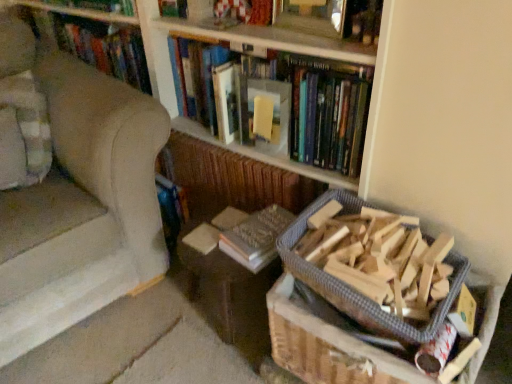
Question: From the image's perspective, is yellow paper at upper center above or below wooden frame at upper center, acting as the 3th book starting from the bottom?

Choices:
 (A) above
 (B) below

Answer: (B)

Question: Would you say yellow paper at upper center is to the left or to the right of wooden frame at upper center, which is the 1th book in top-to-bottom order, in the picture?

Choices:
 (A) left
 (B) right

Answer: (A)

Question: Which of these objects is positioned closest to the hardcover book at upper center, the second book positioned from the bottom?

Choices:
 (A) beige fabric armchair at left
 (B) metallic silver picture frame at upper center
 (C) yellow paper at upper center
 (D) brown cardboard box at lower right
 (E) wooden frame at upper center, acting as the 3th book starting from the bottom

Answer: (C)

Question: Which is nearer to the beige fabric armchair at left?

Choices:
 (A) yellow paper at upper center
 (B) metallic silver picture frame at upper center
 (C) hardcover book at center, the third book positioned from the top
 (D) hardcover book at upper center, which is the second book from top to bottom
 (E) wooden bookcase at upper center

Answer: (E)